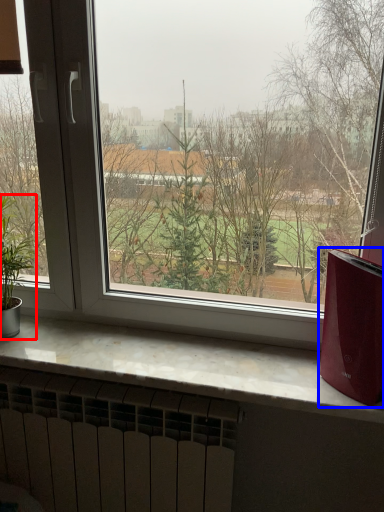
Question: Which object is further to the camera taking this photo, houseplant (highlighted by a red box) or appliance (highlighted by a blue box)?

Choices:
 (A) houseplant
 (B) appliance

Answer: (A)